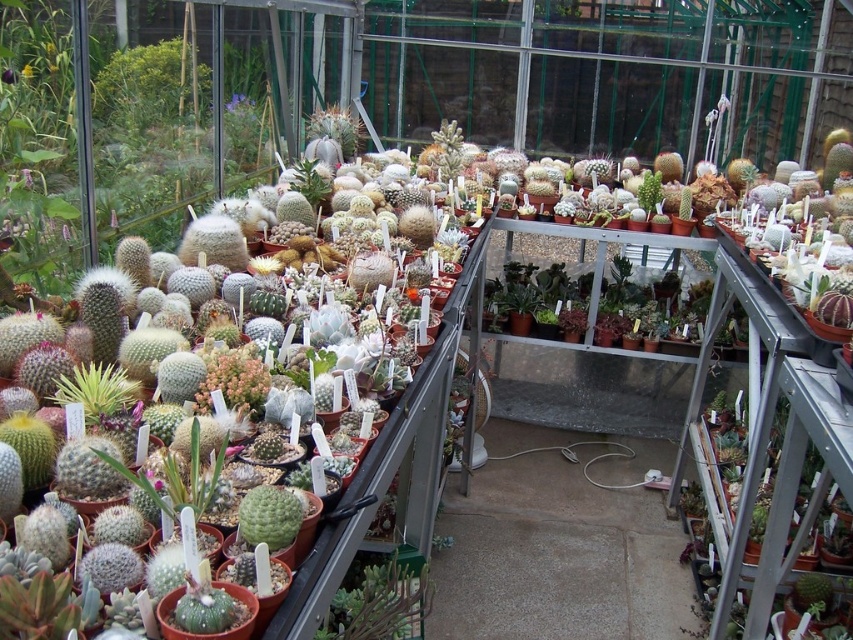
You are a gardener who needs to water two green fuzzy cacti in the greenhouse. The first one is the green fuzzy cactus at left and the second is the green fuzzy cactus at center. If you start from the entrance of the greenhouse, which cactus should you reach first, and why?

The green fuzzy cactus at left is closer to the entrance than the green fuzzy cactus at center. Since the distance between them is 8.40 feet, the one at left will be reached first when moving from the entrance.

Based on the photo, you are a gardener who wants to place a new plant pot between the green matte cactus at lower center and the green fuzzy cactus at left. Based on their widths, which cactus should you consider for spacing adjustments?

The green matte cactus at lower center might be wider than the green fuzzy cactus at left, so you should consider adjusting the spacing around the green matte cactus at lower center to accommodate its width.

You are a gardener who wants to place a new plant pot that is 10 cm wide between the green matte cactus at lower center and the green fuzzy cactus at center. Can you fit it there?

The green matte cactus at lower center has a smaller width than the green fuzzy cactus at center. Since the new plant pot is 10 cm wide, you need to check the space between them. However, the exact distance between the two cacti isn